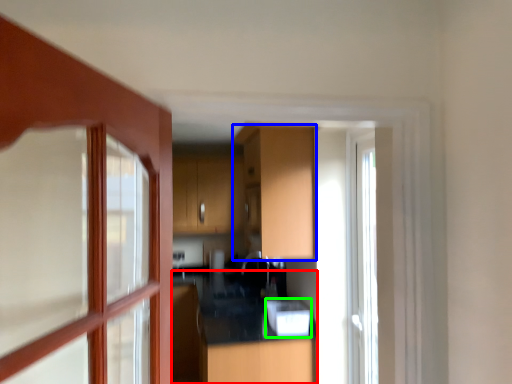
Question: Considering the real-world distances, which object is closest to counter top (highlighted by a red box)? cabinetry (highlighted by a blue box) or appliance (highlighted by a green box).

Choices:
 (A) cabinetry
 (B) appliance

Answer: (B)